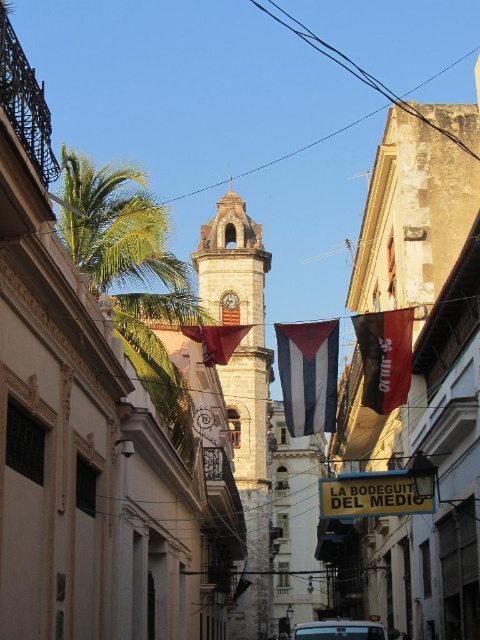
Question: Which of these objects is positioned closest to the stone clock tower at center?

Choices:
 (A) golden metallic clock at center
 (B) striped fabric flag at center

Answer: (A)

Question: Does green leafy palm tree at center appear on the right side of matte red flag at center?

Choices:
 (A) yes
 (B) no

Answer: (B)

Question: Which object is the farthest from the metallic silver car at center?

Choices:
 (A) green leafy palm tree at center
 (B) stone clock tower at center
 (C) striped fabric flag at center
 (D) golden metallic clock at center

Answer: (D)

Question: Where is stone clock tower at center located in relation to metallic silver car at center in the image?

Choices:
 (A) above
 (B) below

Answer: (A)

Question: Among these points, which one is farthest from the camera?

Choices:
 (A) (222, 358)
 (B) (408, 356)
 (C) (377, 636)

Answer: (A)

Question: Where is black fabric flag at center located in relation to golden metallic clock at center in the image?

Choices:
 (A) above
 (B) below

Answer: (B)